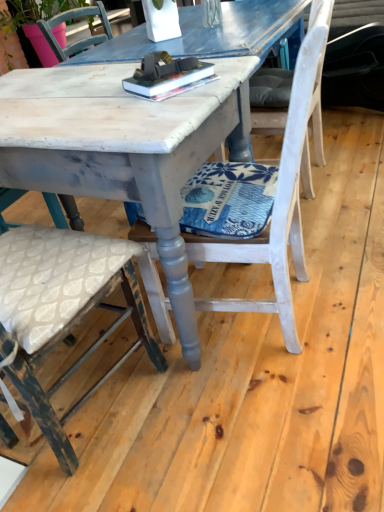
Question: Is distressed white chair at center, the first chair from the left, in contact with white painted wood chair at center, arranged as the third chair when viewed from the left?

Choices:
 (A) yes
 (B) no

Answer: (B)

Question: Does distressed white chair at center, which ranks as the third chair in right-to-left order, lie behind white painted wood chair at center, the 1th chair in the right-to-left sequence?

Choices:
 (A) no
 (B) yes

Answer: (A)

Question: Is distressed white chair at center, the first chair from the left, closer to camera compared to white painted wood chair at center, arranged as the third chair when viewed from the left?

Choices:
 (A) no
 (B) yes

Answer: (B)

Question: Can you confirm if distressed white chair at center, the first chair from the left, is wider than white painted wood chair at center, the 1th chair in the right-to-left sequence?

Choices:
 (A) no
 (B) yes

Answer: (A)

Question: Is distressed white chair at center, the first chair from the left, positioned with its back to white painted wood chair at center, the 1th chair in the right-to-left sequence?

Choices:
 (A) yes
 (B) no

Answer: (B)

Question: From the image's perspective, is distressed white wood table at center positioned above or below matte pink pot at upper left?

Choices:
 (A) below
 (B) above

Answer: (A)

Question: Considering the positions of distressed white wood table at center and matte pink pot at upper left in the image, is distressed white wood table at center bigger or smaller than matte pink pot at upper left?

Choices:
 (A) small
 (B) big

Answer: (A)

Question: From their relative heights in the image, would you say distressed white wood table at center is taller or shorter than matte pink pot at upper left?

Choices:
 (A) short
 (B) tall

Answer: (A)

Question: Relative to matte pink pot at upper left, is distressed white wood table at center in front or behind?

Choices:
 (A) behind
 (B) front

Answer: (B)

Question: Is distressed white wood table at center wider or thinner than hardcover book at center?

Choices:
 (A) thin
 (B) wide

Answer: (B)

Question: Is point (193, 321) closer or farther from the camera than point (147, 77)?

Choices:
 (A) closer
 (B) farther

Answer: (B)

Question: Considering the positions of distressed white wood table at center and hardcover book at center in the image, is distressed white wood table at center taller or shorter than hardcover book at center?

Choices:
 (A) short
 (B) tall

Answer: (B)

Question: Would you say distressed white wood table at center is to the left or to the right of hardcover book at center in the picture?

Choices:
 (A) right
 (B) left

Answer: (B)

Question: Is point (188, 66) closer or farther from the camera than point (150, 193)?

Choices:
 (A) farther
 (B) closer

Answer: (A)

Question: Considering the positions of hardcover book at center and distressed white wood table at center in the image, is hardcover book at center bigger or smaller than distressed white wood table at center?

Choices:
 (A) small
 (B) big

Answer: (A)